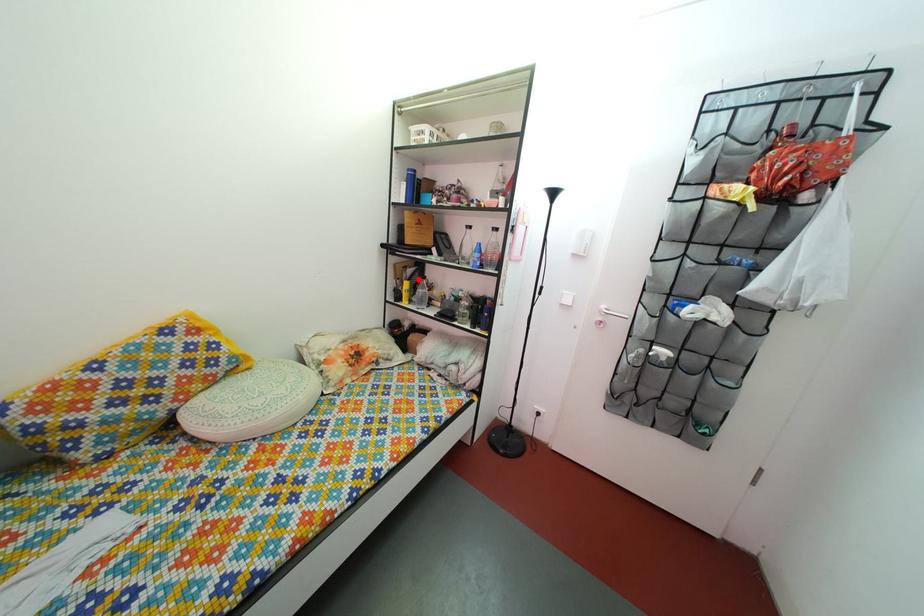
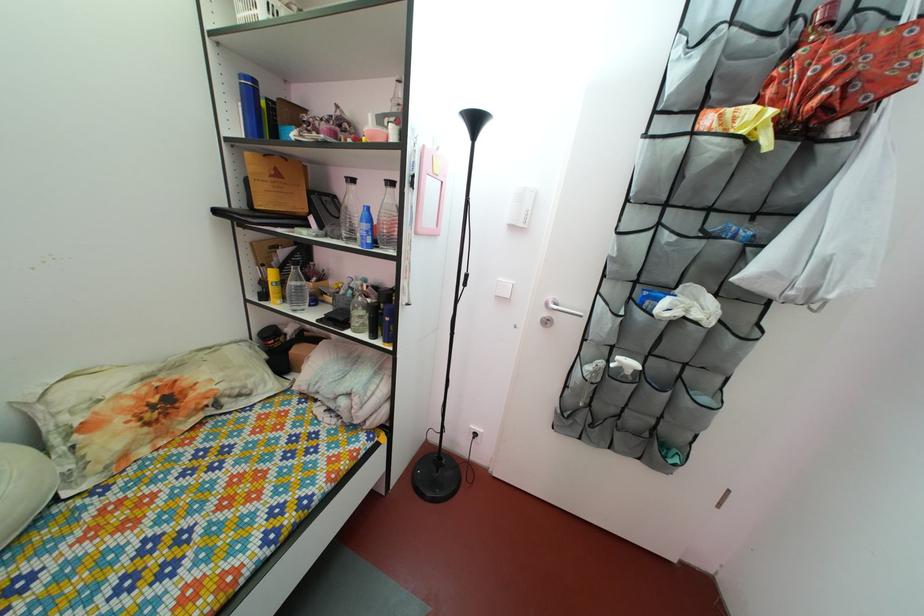
Locate, in the second image, the point that corresponds to the highlighted location in the first image.

(292, 262)